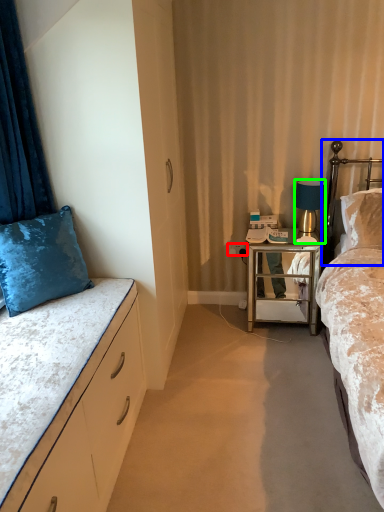
Question: Considering the real-world distances, which object is farthest from power outlet (highlighted by a red box)? headboard (highlighted by a blue box) or lamp (highlighted by a green box)?

Choices:
 (A) headboard
 (B) lamp

Answer: (A)